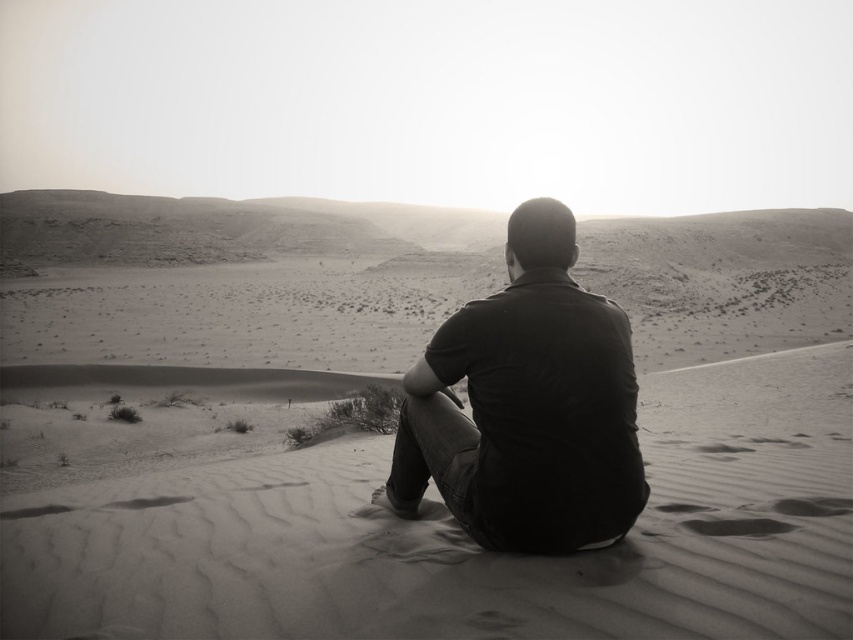
You are a photographer trying to capture the figure sitting on the sand dune. You notice the smooth sand at center and the dark cotton shirt at center. Which object is closer to the camera?

The dark cotton shirt at center is closer to the camera because it is above the smooth sand at center, which is positioned below it.

Based on the scene described, where is the smooth sand at center located in relation to the dark cotton shirt at center?

The smooth sand at center is located to the right of the dark cotton shirt at center.